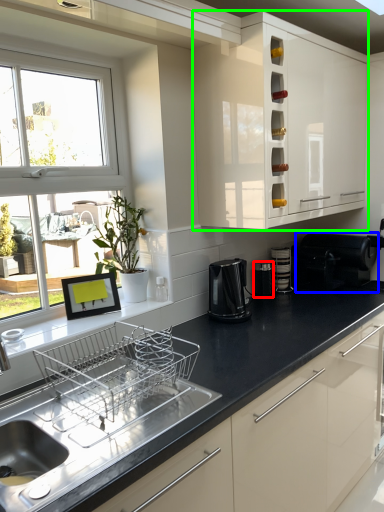
Question: Considering the real-world distances, which object is closest to appliance (highlighted by a red box)? appliance (highlighted by a blue box) or cabinetry (highlighted by a green box).

Choices:
 (A) appliance
 (B) cabinetry

Answer: (A)